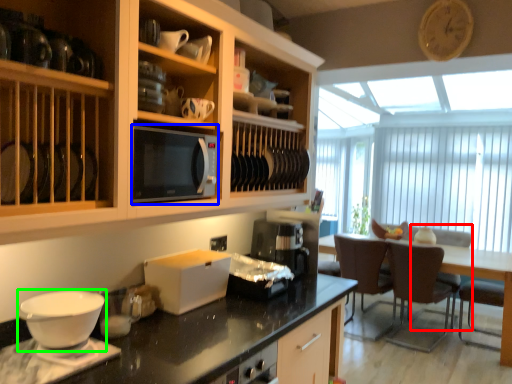
Question: Which is farther away from armchair (highlighted by a red box)? microwave oven (highlighted by a blue box) or coffee cup (highlighted by a green box)?

Choices:
 (A) microwave oven
 (B) coffee cup

Answer: (B)